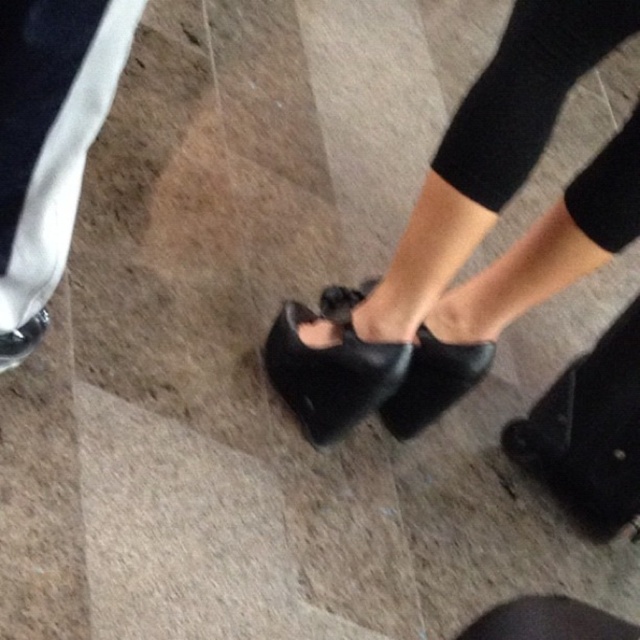
Is black knit tights at center further to the viewer compared to black leather sandal at center?

No.

Which is below, black knit tights at center or black leather sandal at center?

black leather sandal at center is lower down.

This screenshot has height=640, width=640. In order to click on black knit tights at center in this screenshot , I will do `click(525, 92)`.

Identify the location of black knit tights at center. Image resolution: width=640 pixels, height=640 pixels. (525, 92).

Does black leather sandal at center lie behind black leather shoe at center?

No, it is not.

Can you confirm if black leather sandal at center is taller than black leather shoe at center?

Yes.

This screenshot has width=640, height=640. Find the location of `black leather sandal at center`. black leather sandal at center is located at coordinates (332, 365).

Locate an element on the screen. black leather sandal at center is located at coordinates (332, 365).

How distant is black knit tights at center from matte black shoe at lower center?

black knit tights at center and matte black shoe at lower center are 27.63 inches apart from each other.

Does point (579, 26) lie in front of point (20, 346)?

That is True.

The width and height of the screenshot is (640, 640). I want to click on black knit tights at center, so click(x=525, y=92).